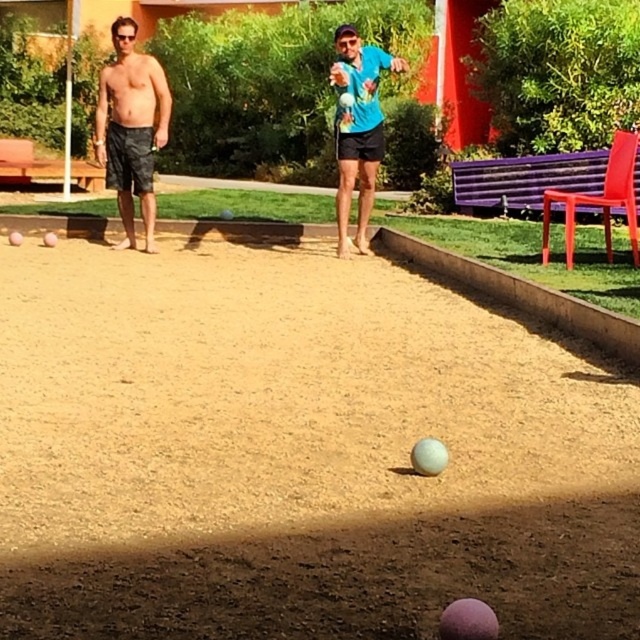
Question: Among these objects, which one is farthest from the camera?

Choices:
 (A) blue matte shirt at center
 (B) camouflage shorts at left

Answer: (B)

Question: Is brown sandy ground at center behind camouflage shorts at left?

Choices:
 (A) no
 (B) yes

Answer: (A)

Question: Where is camouflage shorts at left located in relation to blue matte shirt at center in the image?

Choices:
 (A) below
 (B) above

Answer: (B)

Question: Which object is the closest to the camouflage shorts at left?

Choices:
 (A) brown sandy ground at center
 (B) blue matte shirt at center

Answer: (B)

Question: Which of the following is the farthest from the observer?

Choices:
 (A) (364, 180)
 (B) (68, 518)

Answer: (A)

Question: Is brown sandy ground at center closer to the viewer compared to camouflage shorts at left?

Choices:
 (A) no
 (B) yes

Answer: (B)